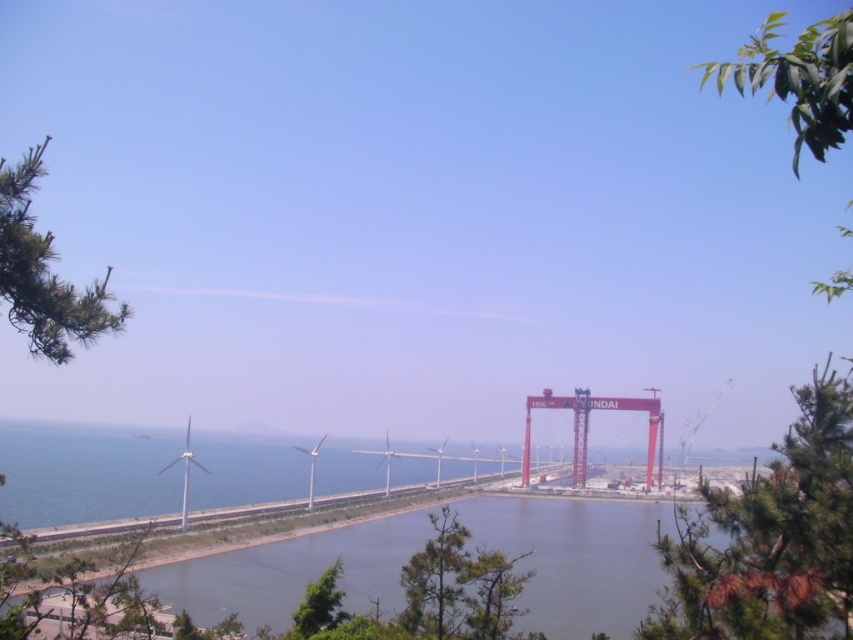
Is brown textured tree at lower right smaller than green pine tree at left?

No.

Can you confirm if brown textured tree at lower right is bigger than green pine tree at left?

Yes.

Who is more forward, (784, 465) or (6, 260)?

Point (6, 260) is more forward.

You are a GUI agent. You are given a task and a screenshot of the screen. Output one action in this format:
    pyautogui.click(x=<x>, y=<y>)
    Task: Click on the brown textured tree at lower right
    Image resolution: width=853 pixels, height=640 pixels.
    Given the screenshot: What is the action you would take?
    pyautogui.click(x=770, y=538)

Between green leafy tree at upper right and green leafy tree at lower center, which one has more height?

With more height is green leafy tree at upper right.

Is green leafy tree at upper right wider than green leafy tree at lower center?

Yes, green leafy tree at upper right is wider than green leafy tree at lower center.

I want to click on green leafy tree at upper right, so click(772, 538).

What are the coordinates of `green leafy tree at upper right` in the screenshot? It's located at (772, 538).

Which of these two, clear water at lower center or green leafy branch at upper right, stands taller?

Standing taller between the two is green leafy branch at upper right.

Does clear water at lower center appear on the left side of green leafy branch at upper right?

Indeed, clear water at lower center is positioned on the left side of green leafy branch at upper right.

The image size is (853, 640). What do you see at coordinates (576, 557) in the screenshot?
I see `clear water at lower center` at bounding box center [576, 557].

The image size is (853, 640). I want to click on clear water at lower center, so click(576, 557).